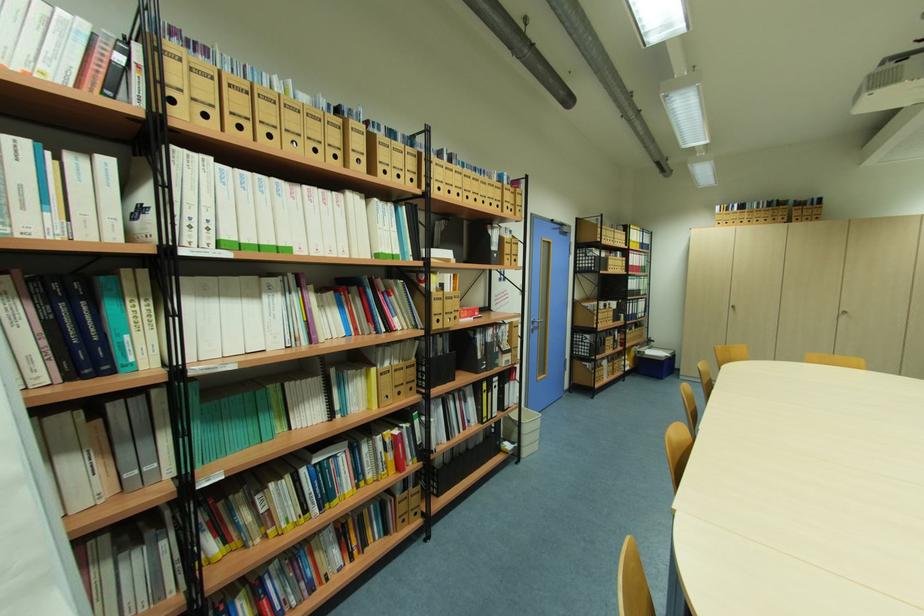
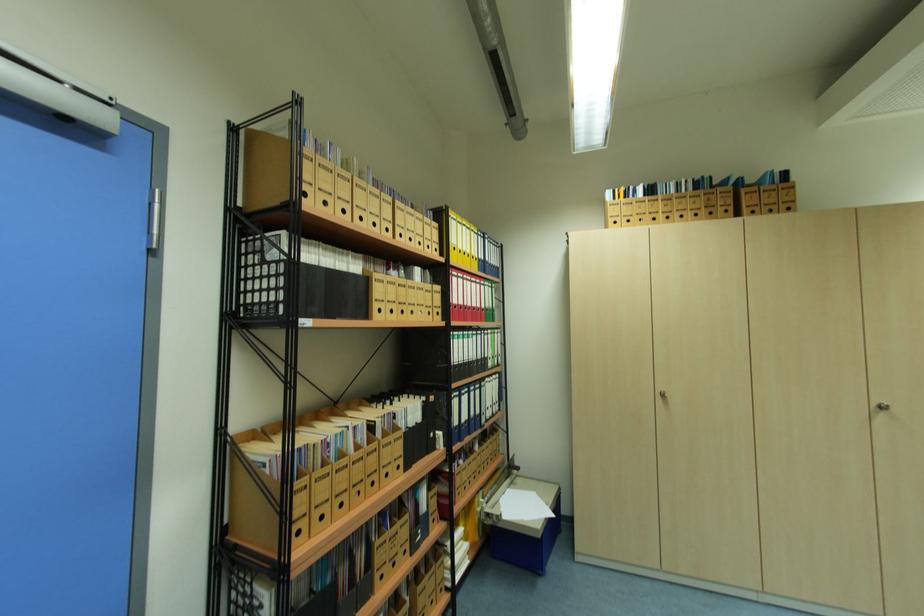
In a continuous first-person perspective shot, in which direction is the camera moving?

The movement direction of the cameraman is right, forward.